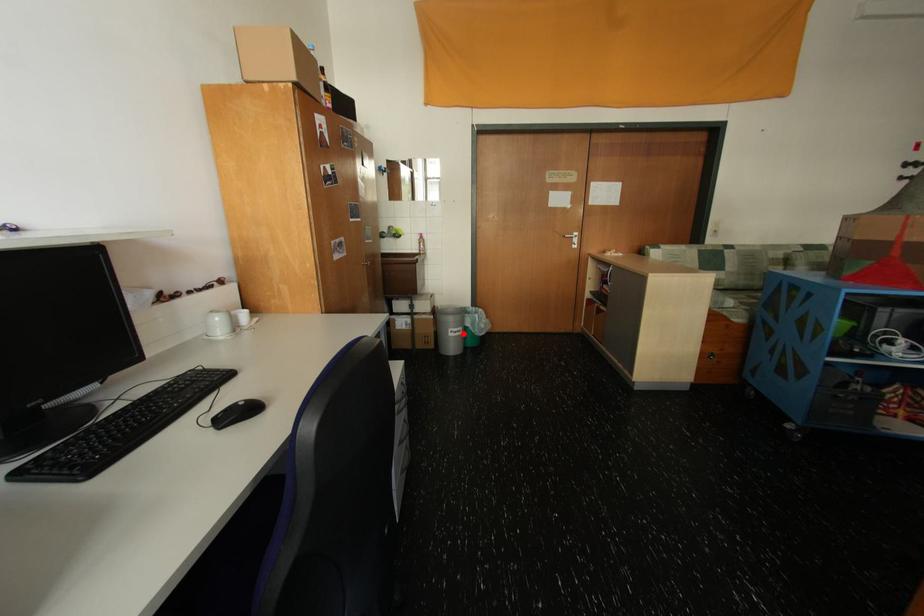
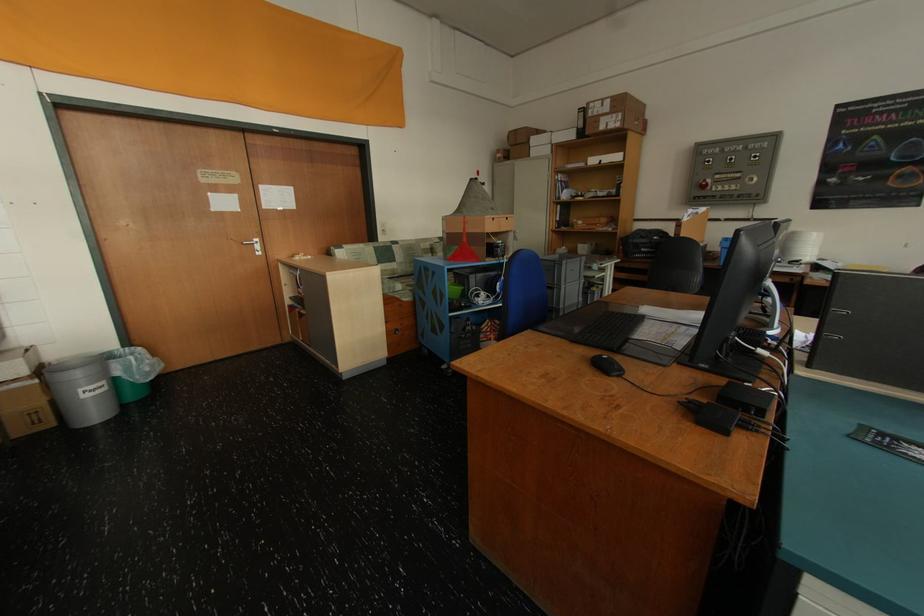
Question: I am providing you with two images of the same scene from different viewpoints. In image1, a red point is highlighted. Considering the same 3D point in image2, which of the following is correct?

Choices:
 (A) It is closer
 (B) It is farther

Answer: (A)